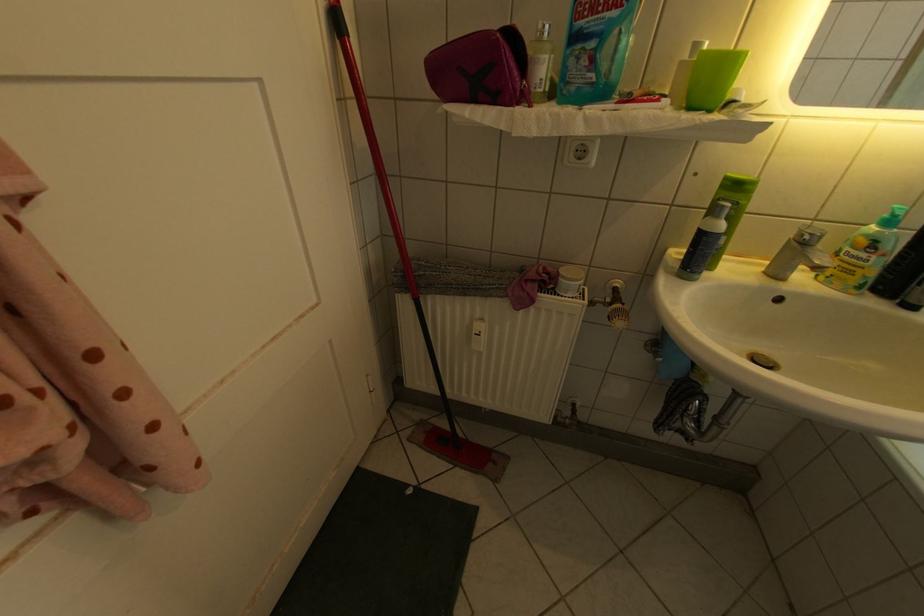
The image size is (924, 616). Describe the element at coordinates (712, 78) in the screenshot. I see `a green plastic cup` at that location.